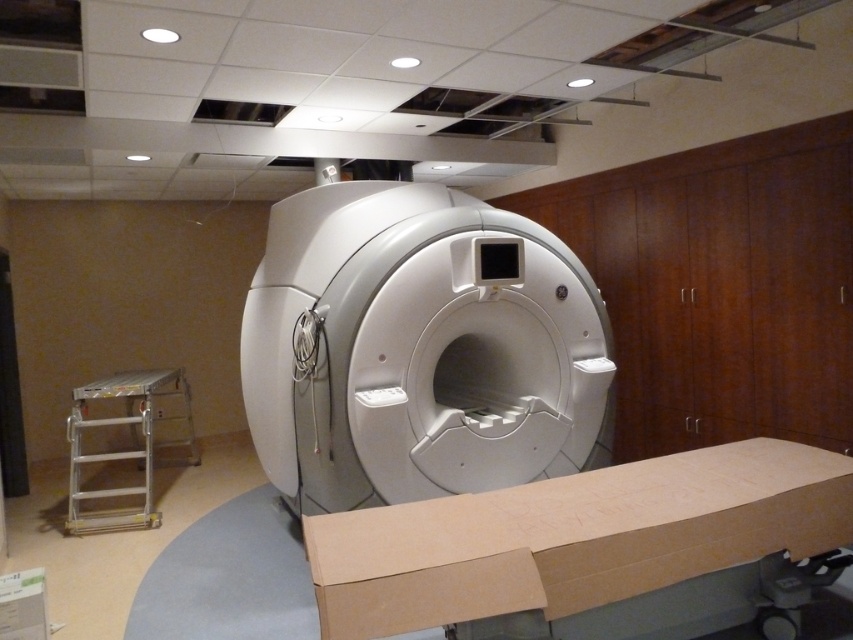
Question: Is white plastic mri scanner at center to the left of silver metallic ladder at lower left from the viewer's perspective?

Choices:
 (A) yes
 (B) no

Answer: (B)

Question: Which of the following is the closest to the observer?

Choices:
 (A) (519, 497)
 (B) (444, 460)

Answer: (A)

Question: Is brown cardboard box at lower center smaller than silver metallic ladder at lower left?

Choices:
 (A) yes
 (B) no

Answer: (A)

Question: Does white plastic mri scanner at center have a lesser width compared to brown cardboard box at lower center?

Choices:
 (A) no
 (B) yes

Answer: (A)

Question: Estimate the real-world distances between objects in this image. Which object is closer to the brown cardboard box at lower center?

Choices:
 (A) silver metallic ladder at lower left
 (B) white plastic mri scanner at center

Answer: (B)

Question: Which point is closer to the camera taking this photo?

Choices:
 (A) (262, 374)
 (B) (757, 541)
 (C) (102, 490)

Answer: (B)